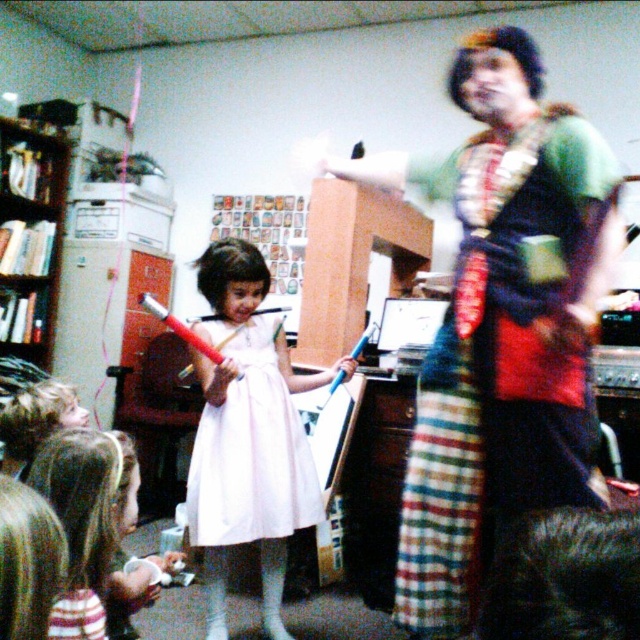
Question: Estimate the real-world distances between objects in this image. Which object is farther from the green textured dress at center?

Choices:
 (A) white satin dress at center
 (B) matte pink dress at center
 (C) blonde hair at lower left
 (D) white fabric dress at center

Answer: (D)

Question: Can you confirm if white satin dress at center is positioned to the left of wooden bookshelf at left?

Choices:
 (A) no
 (B) yes

Answer: (A)

Question: Does green textured dress at center come in front of white satin dress at center?

Choices:
 (A) no
 (B) yes

Answer: (B)

Question: Which point is closer to the camera?

Choices:
 (A) matte pink dress at center
 (B) white satin dress at center
 (C) wooden bookshelf at left

Answer: (A)

Question: Which point is closer to the camera?

Choices:
 (A) white satin dress at center
 (B) white fabric dress at center
 (C) blonde hair at lower left
 (D) green textured dress at center

Answer: (C)

Question: Does matte pink dress at center appear under wooden bookshelf at left?

Choices:
 (A) no
 (B) yes

Answer: (B)